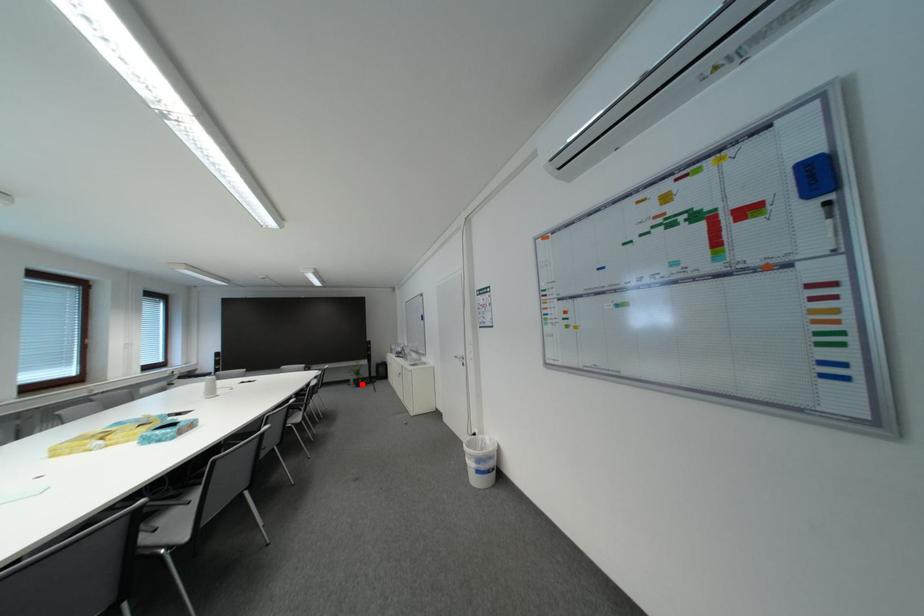
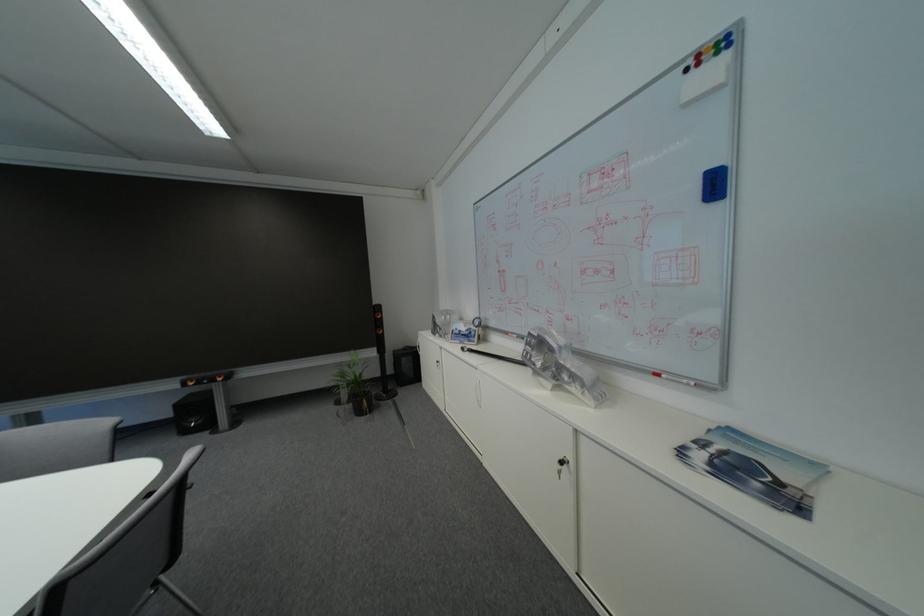
Where in the second image is the point corresponding to the highlighted location from the first image?

(354, 399)